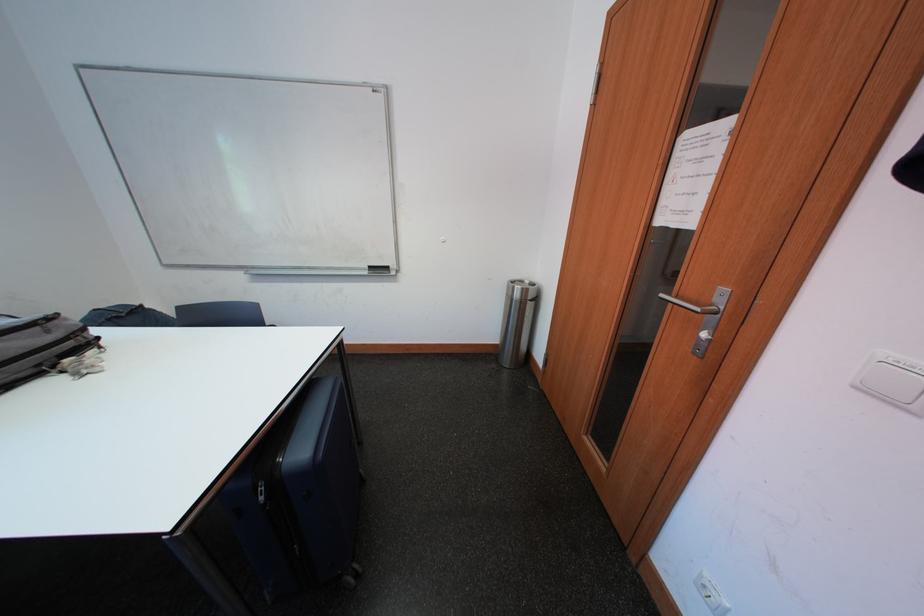
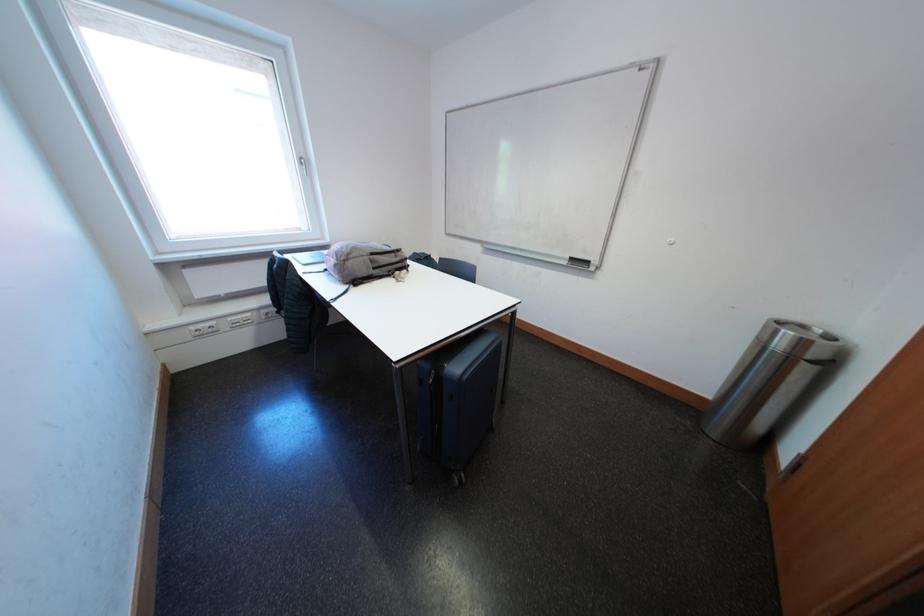
Where in the second image is the point corresponding to [540,301] from the first image?

(821, 360)